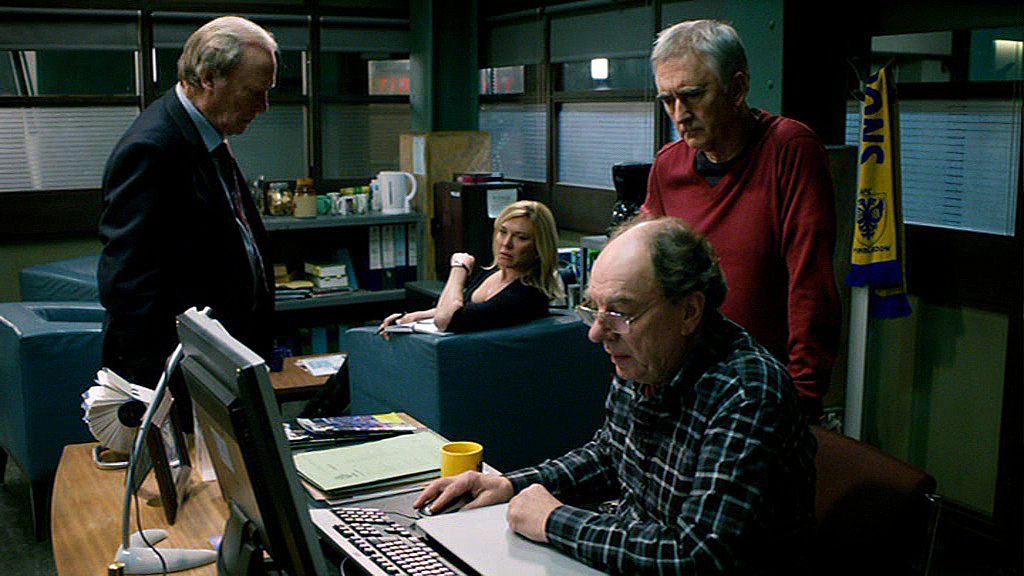
The width and height of the screenshot is (1024, 576). In order to click on monitor in this screenshot , I will do `click(272, 456)`.